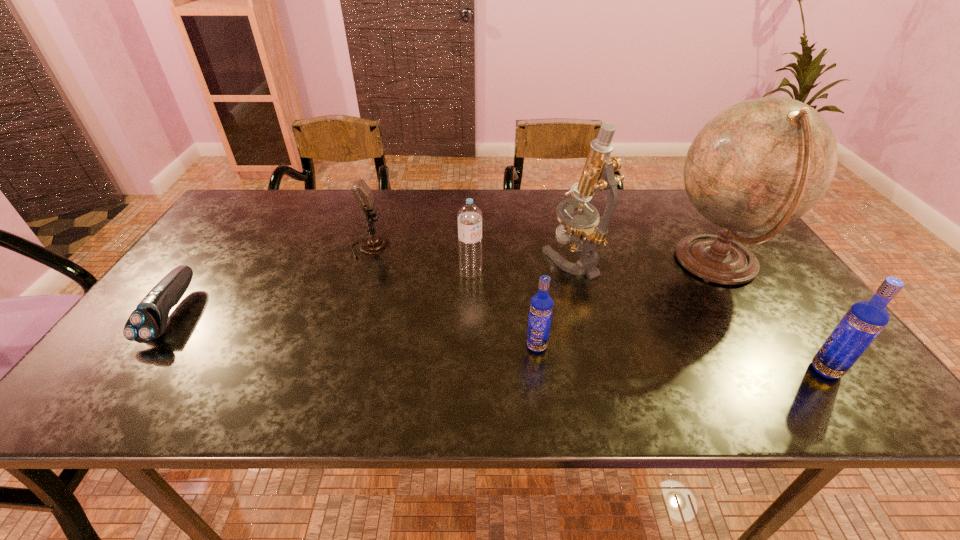
The vodkas are evenly distributed in the image. To maintain this, where would you place another vodka on the left? Please point to a free space. Please provide its 2D coordinates. Your answer should be formatted as a tuple, i.e. [(x, y)], where the tuple contains the x and y coordinates of a point satisfying the conditions above.

[(276, 324)]